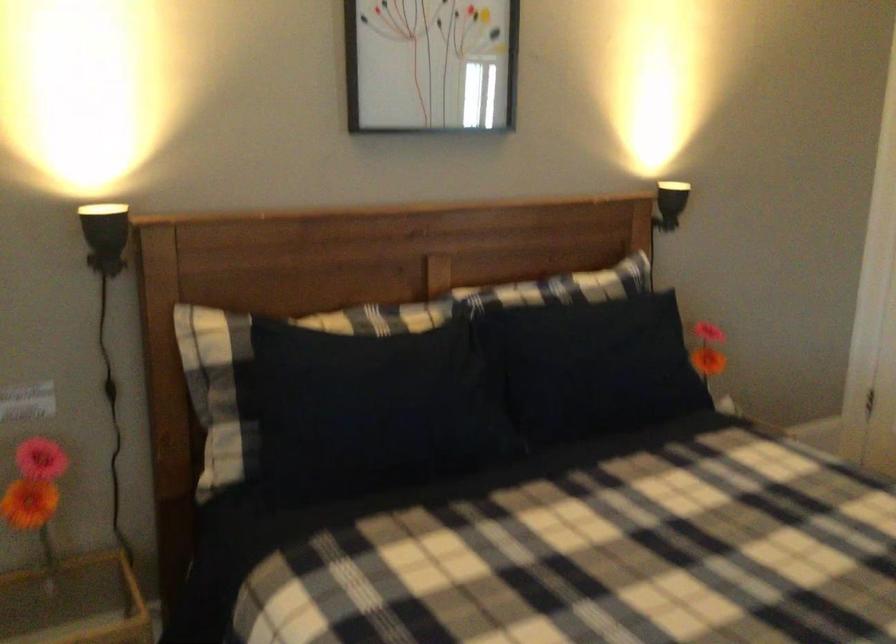
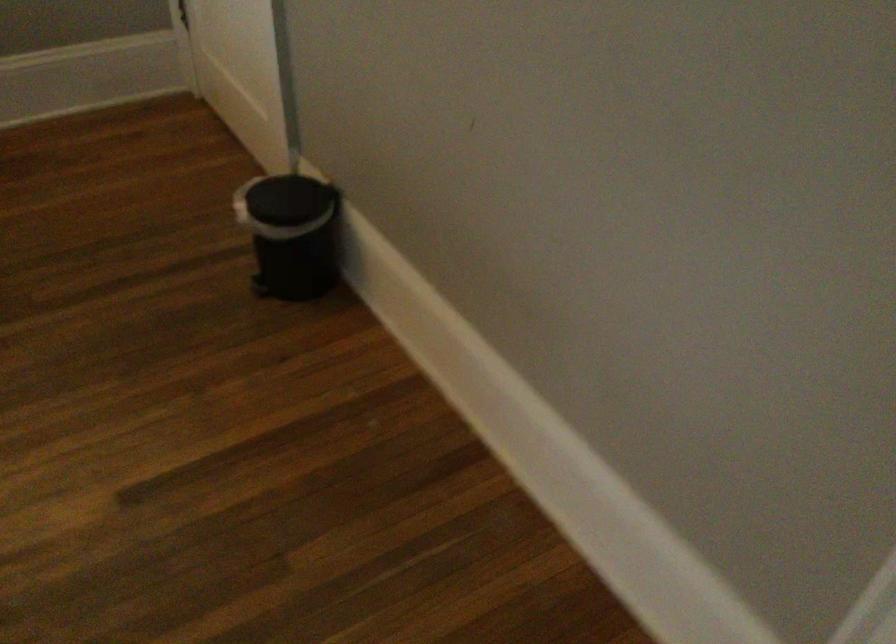
Question: Which direction would the cameraman need to move to produce the second image? Reply with the corresponding letter.

Choices:
 (A) Left
 (B) Right
 (C) Forward
 (D) Backward

Answer: (B)